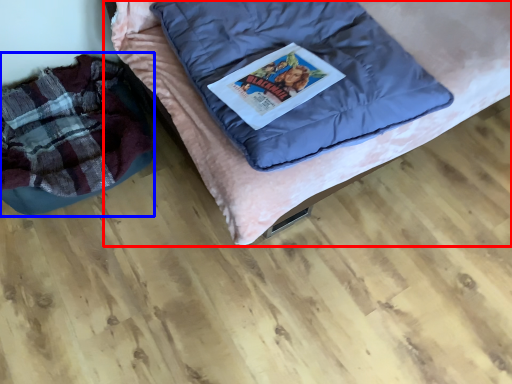
Question: Among these objects, which one is farthest to the camera, furniture (highlighted by a red box) or bean bag chair (highlighted by a blue box)?

Choices:
 (A) furniture
 (B) bean bag chair

Answer: (B)